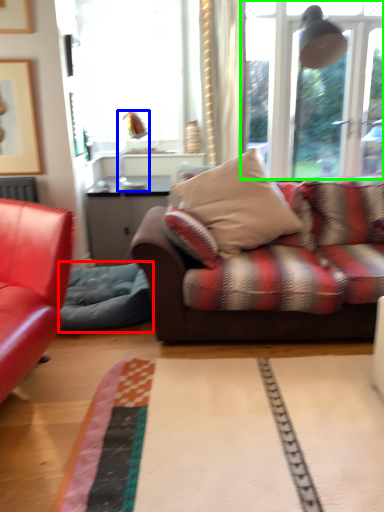
Question: Considering the real-world distances, which object is closest to swivel chair (highlighted by a red box)? lamp (highlighted by a blue box) or window (highlighted by a green box).

Choices:
 (A) lamp
 (B) window

Answer: (A)